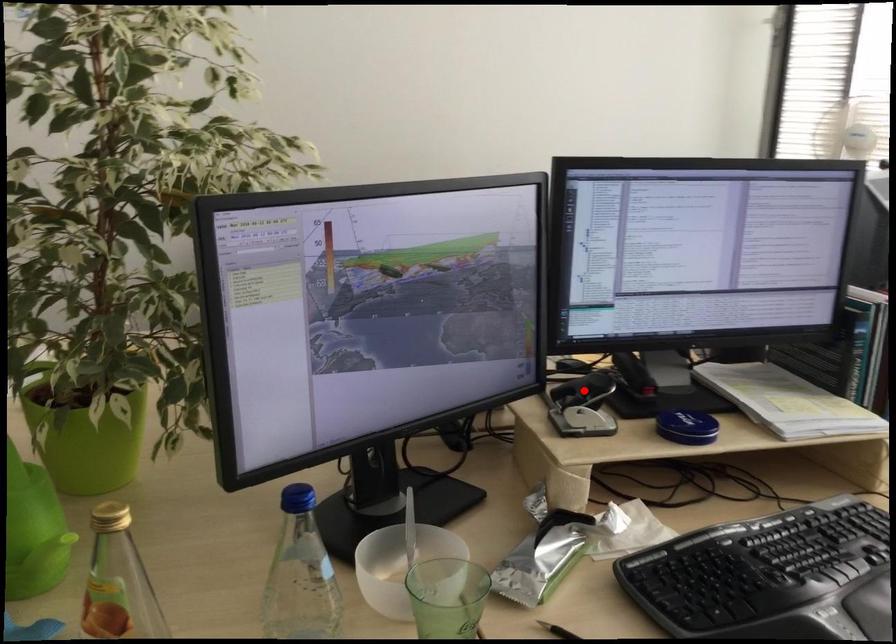
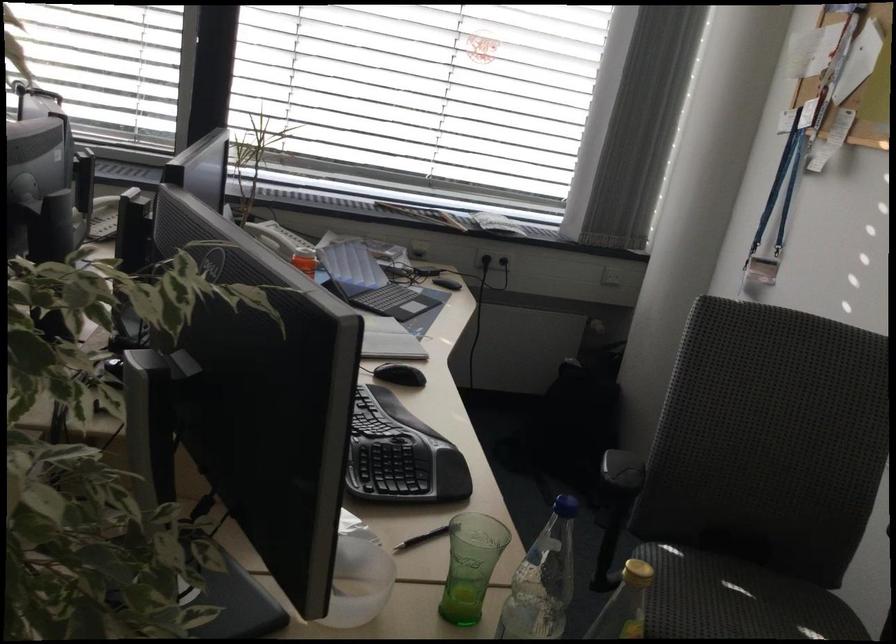
Question: I am providing you with two images of the same scene from different viewpoints. A red point is marked on the first image. At the location where the point appears in image 1, is it still visible in image 2?

Choices:
 (A) Yes
 (B) No

Answer: (B)